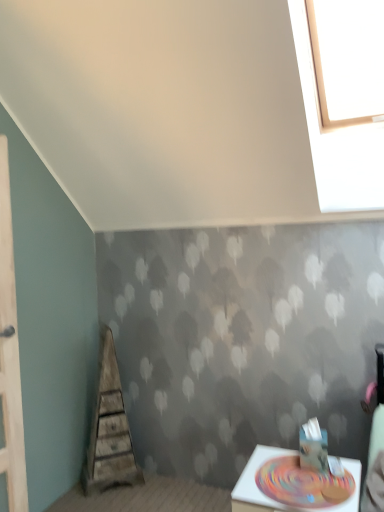
This screenshot has width=384, height=512. What do you see at coordinates (293, 485) in the screenshot?
I see `white glossy table at lower right` at bounding box center [293, 485].

Find the location of a particular element. Image resolution: width=384 pixels, height=512 pixels. white glossy table at lower right is located at coordinates (293, 485).

Measure the distance between point (x=248, y=502) and camera.

The depth of point (x=248, y=502) is 1.67 meters.

Where is `white glossy table at lower right`? Image resolution: width=384 pixels, height=512 pixels. white glossy table at lower right is located at coordinates (293, 485).